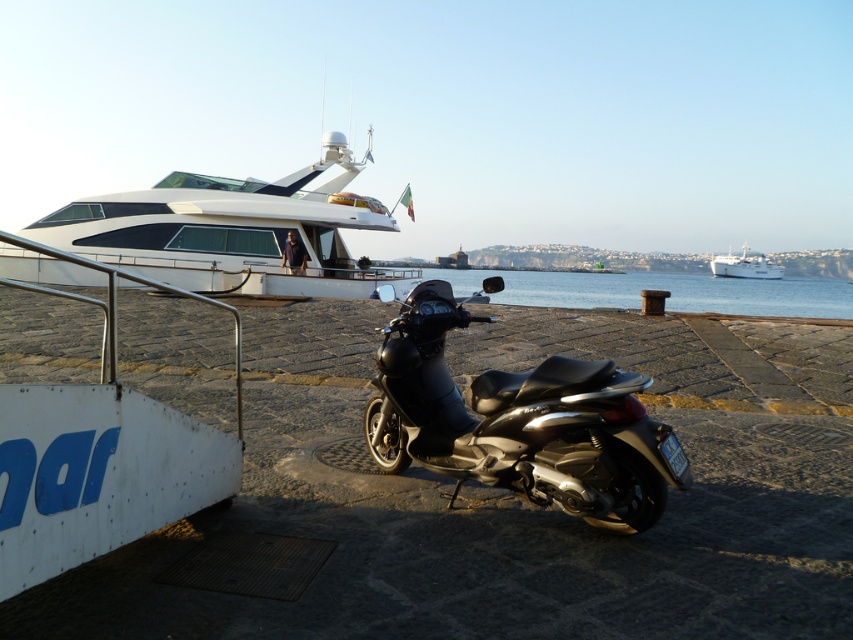
Is point (256, 243) positioned in front of point (587, 292)?

That is True.

Can you confirm if white glossy yacht at upper left is positioned to the left of blue water at center?

Indeed, white glossy yacht at upper left is positioned on the left side of blue water at center.

The image size is (853, 640). Identify the location of white glossy yacht at upper left. (231, 230).

You are a GUI agent. You are given a task and a screenshot of the screen. Output one action in this format:
    pyautogui.click(x=<x>, y=<y>)
    Task: Click on the white glossy yacht at upper left
    The width and height of the screenshot is (853, 640).
    Given the screenshot: What is the action you would take?
    pyautogui.click(x=231, y=230)

Does shiny black scooter at center have a larger size compared to blue water at center?

Incorrect, shiny black scooter at center is not larger than blue water at center.

Does shiny black scooter at center appear over blue water at center?

No, shiny black scooter at center is not above blue water at center.

Is point (564, 372) less distant than point (770, 296)?

Yes, it is in front of point (770, 296).

The image size is (853, 640). Identify the location of shiny black scooter at center. (520, 422).

This screenshot has height=640, width=853. Describe the element at coordinates (660, 289) in the screenshot. I see `blue water at center` at that location.

Does point (537, 289) lie behind point (750, 269)?

No, (537, 289) is in front of (750, 269).

This screenshot has height=640, width=853. I want to click on blue water at center, so click(x=660, y=289).